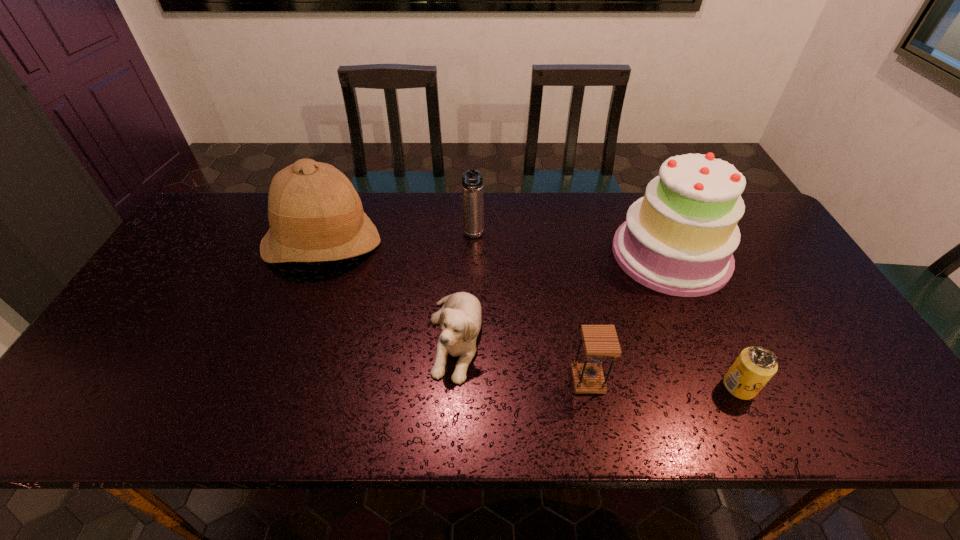
The width and height of the screenshot is (960, 540). What are the coordinates of `vacant area that lies between the puppy and the hat` in the screenshot? It's located at (389, 291).

In order to click on the second closest object to the hat in this screenshot , I will do `click(472, 180)`.

Identify which object is the third nearest to the hat. Please provide its 2D coordinates. Your answer should be formatted as a tuple, i.e. [(x, y)], where the tuple contains the x and y coordinates of a point satisfying the conditions above.

[(600, 341)]

Locate an element on the screen. The image size is (960, 540). free space that satisfies the following two spatial constraints: 1. on the front side of the cake; 2. on the right side of the beer can is located at coordinates (729, 386).

Find the location of a particular element. blank space that satisfies the following two spatial constraints: 1. on the front-facing side of the hat; 2. on the right side of the cake is located at coordinates (318, 254).

Locate an element on the screen. This screenshot has height=540, width=960. free spot that satisfies the following two spatial constraints: 1. on the handle side of the beer can; 2. on the right side of the third tallest object is located at coordinates (470, 386).

Locate an element on the screen. Image resolution: width=960 pixels, height=540 pixels. free location that satisfies the following two spatial constraints: 1. on the front-facing side of the hat; 2. on the left side of the cake is located at coordinates (318, 254).

Locate an element on the screen. This screenshot has width=960, height=540. blank area in the image that satisfies the following two spatial constraints: 1. on the front-facing side of the hat; 2. on the right side of the fourth object from left to right is located at coordinates (271, 380).

Identify the location of vacant area in the image that satisfies the following two spatial constraints: 1. on the handle side of the fourth shortest object; 2. on the left side of the fourth object from left to right. This screenshot has height=540, width=960. pos(470,380).